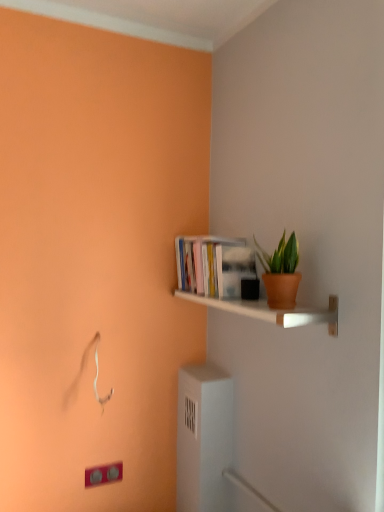
Question: From the image's perspective, would you say matte white light switch at lower left is shown under hardcover books at upper right?

Choices:
 (A) no
 (B) yes

Answer: (B)

Question: Is matte white light switch at lower left facing towards hardcover books at upper right?

Choices:
 (A) yes
 (B) no

Answer: (B)

Question: Is hardcover books at upper right at the back of matte white light switch at lower left?

Choices:
 (A) no
 (B) yes

Answer: (A)

Question: Can you confirm if matte white light switch at lower left is positioned to the left of hardcover books at upper right?

Choices:
 (A) no
 (B) yes

Answer: (B)

Question: Does matte white light switch at lower left come behind hardcover books at upper right?

Choices:
 (A) no
 (B) yes

Answer: (B)

Question: From a real-world perspective, is hardcover books at upper right positioned above or below white glossy shelf at upper right?

Choices:
 (A) above
 (B) below

Answer: (A)

Question: Considering the positions of hardcover books at upper right and white glossy shelf at upper right in the image, is hardcover books at upper right wider or thinner than white glossy shelf at upper right?

Choices:
 (A) wide
 (B) thin

Answer: (B)

Question: Is point (231, 248) positioned closer to the camera than point (327, 323)?

Choices:
 (A) farther
 (B) closer

Answer: (A)

Question: Is hardcover books at upper right inside or outside of white glossy shelf at upper right?

Choices:
 (A) inside
 (B) outside

Answer: (B)

Question: Looking at the image, does matte white light switch at lower left seem bigger or smaller compared to terracotta clay pot at upper right?

Choices:
 (A) big
 (B) small

Answer: (B)

Question: Is matte white light switch at lower left wider or thinner than terracotta clay pot at upper right?

Choices:
 (A) wide
 (B) thin

Answer: (B)

Question: Is matte white light switch at lower left inside or outside of terracotta clay pot at upper right?

Choices:
 (A) inside
 (B) outside

Answer: (B)

Question: From the image's perspective, is matte white light switch at lower left located above or below terracotta clay pot at upper right?

Choices:
 (A) below
 (B) above

Answer: (A)

Question: Considering the positions of point (329, 310) and point (201, 272), is point (329, 310) closer or farther from the camera than point (201, 272)?

Choices:
 (A) farther
 (B) closer

Answer: (B)

Question: Is white glossy shelf at upper right taller or shorter than hardcover books at upper right?

Choices:
 (A) short
 (B) tall

Answer: (A)